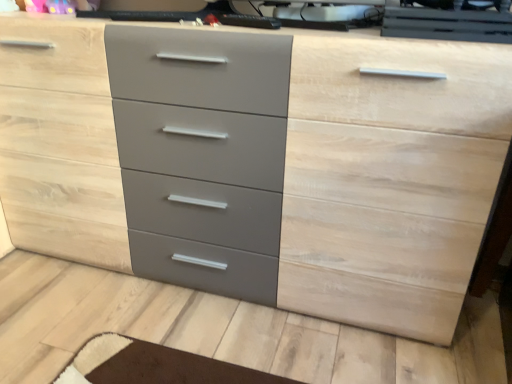
Question: Which direction should I rotate to look at matte black desktop computer at upper center, the 1th desktop computer from the left?

Choices:
 (A) left
 (B) right

Answer: (B)

Question: Is glossy black desktop computer at upper center, the 1th desktop computer from the right, bigger than matte black desktop computer at upper center, the 1th desktop computer from the left?

Choices:
 (A) no
 (B) yes

Answer: (B)

Question: Can you see glossy black desktop computer at upper center, the 1th desktop computer from the right, touching matte black desktop computer at upper center, which is counted as the second desktop computer, starting from the right?

Choices:
 (A) no
 (B) yes

Answer: (A)

Question: From a real-world perspective, is glossy black desktop computer at upper center, the 1th desktop computer from the right, positioned over matte black desktop computer at upper center, which is counted as the second desktop computer, starting from the right, based on gravity?

Choices:
 (A) yes
 (B) no

Answer: (A)

Question: From a real-world perspective, is glossy black desktop computer at upper center, which is counted as the second desktop computer, starting from the left, under matte black desktop computer at upper center, which is counted as the second desktop computer, starting from the right?

Choices:
 (A) no
 (B) yes

Answer: (A)

Question: Can you confirm if glossy black desktop computer at upper center, the 1th desktop computer from the right, is smaller than matte black desktop computer at upper center, which is counted as the second desktop computer, starting from the right?

Choices:
 (A) no
 (B) yes

Answer: (A)

Question: Would you say glossy black desktop computer at upper center, the 1th desktop computer from the right, is outside matte black desktop computer at upper center, the 1th desktop computer from the left?

Choices:
 (A) yes
 (B) no

Answer: (A)

Question: From a real-world perspective, is matte black desktop computer at upper center, which is counted as the second desktop computer, starting from the right, on top of glossy black desktop computer at upper center, the 1th desktop computer from the right?

Choices:
 (A) no
 (B) yes

Answer: (A)

Question: From the image's perspective, is matte black desktop computer at upper center, the 1th desktop computer from the left, on top of glossy black desktop computer at upper center, the 1th desktop computer from the right?

Choices:
 (A) no
 (B) yes

Answer: (B)

Question: Does matte black desktop computer at upper center, which is counted as the second desktop computer, starting from the right, lie in front of glossy black desktop computer at upper center, which is counted as the second desktop computer, starting from the left?

Choices:
 (A) no
 (B) yes

Answer: (A)

Question: Can you confirm if matte black desktop computer at upper center, which is counted as the second desktop computer, starting from the right, is taller than glossy black desktop computer at upper center, which is counted as the second desktop computer, starting from the left?

Choices:
 (A) yes
 (B) no

Answer: (B)

Question: Considering the relative sizes of matte black desktop computer at upper center, which is counted as the second desktop computer, starting from the right, and glossy black desktop computer at upper center, the 1th desktop computer from the right, in the image provided, is matte black desktop computer at upper center, which is counted as the second desktop computer, starting from the right, shorter than glossy black desktop computer at upper center, the 1th desktop computer from the right,?

Choices:
 (A) no
 (B) yes

Answer: (B)

Question: Is matte black desktop computer at upper center, which is counted as the second desktop computer, starting from the right, facing towards glossy black desktop computer at upper center, the 1th desktop computer from the right?

Choices:
 (A) yes
 (B) no

Answer: (A)

Question: Is matte black desktop computer at upper center, the 1th desktop computer from the left, spatially inside glossy black desktop computer at upper center, which is counted as the second desktop computer, starting from the left, or outside of it?

Choices:
 (A) inside
 (B) outside

Answer: (B)